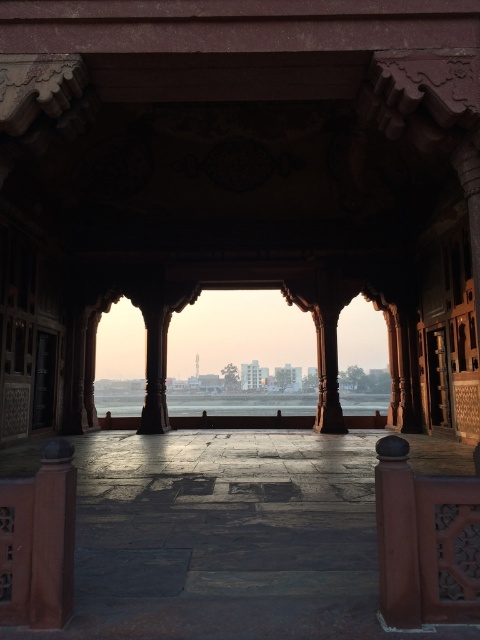
In the scene shown: Does polished stone pillar at center appear on the right side of smooth stone pillar at center?

Incorrect, polished stone pillar at center is not on the right side of smooth stone pillar at center.

Consider the image. Measure the distance between polished stone pillar at center and camera.

A distance of 53.35 feet exists between polished stone pillar at center and camera.

Which is in front, point (164, 381) or point (345, 429)?

Point (345, 429)

The image size is (480, 640). Find the location of `polished stone pillar at center`. polished stone pillar at center is located at coordinates (155, 369).

Who is higher up, smooth reddish-brown pillar at left or transparent glass water at center?

Positioned higher is smooth reddish-brown pillar at left.

Does point (60, 545) lie in front of point (200, 406)?

Yes, it is in front of point (200, 406).

Is point (44, 589) less distant than point (101, 397)?

Yes.

At what (x,y) coordinates should I click in order to perform the action: click on smooth reddish-brown pillar at left. Please return your answer as a coordinate pair (x, y). The width and height of the screenshot is (480, 640). Looking at the image, I should click on (52, 536).

Which is behind, point (72, 508) or point (336, 406)?

Point (336, 406)

Does smooth reddish-brown pillar at left appear over smooth stone pillar at center?

Indeed, smooth reddish-brown pillar at left is positioned over smooth stone pillar at center.

Where is `smooth reddish-brown pillar at left`? The image size is (480, 640). smooth reddish-brown pillar at left is located at coordinates (52, 536).